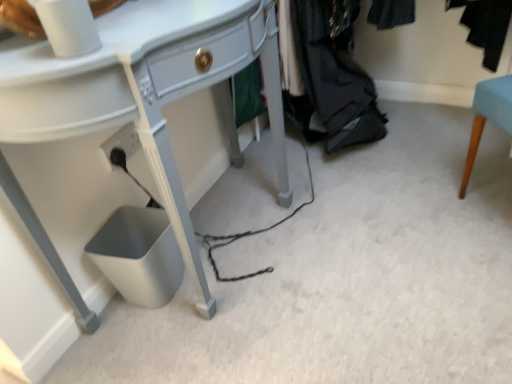
This screenshot has width=512, height=384. Identify the location of vacant area that is in front of dark gray fabric at lower right. (372, 182).